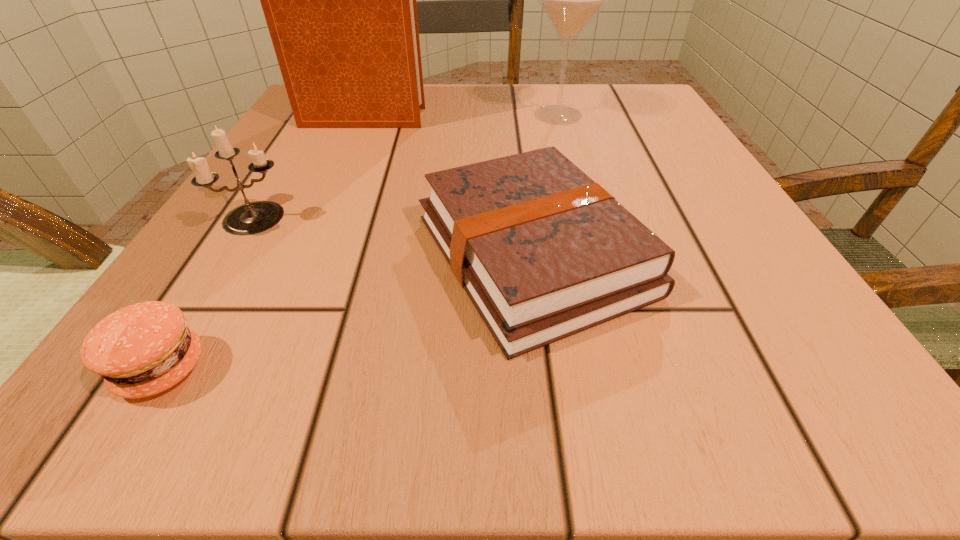
Identify the location of free region located 0.290m on the left of the shorter hardback book. (191, 254).

Where is `free point located 0.290m on the right of the patty`? The width and height of the screenshot is (960, 540). free point located 0.290m on the right of the patty is located at coordinates (491, 368).

Locate an element on the screen. This screenshot has width=960, height=540. hardback book that is at the far edge is located at coordinates (339, 0).

Where is `martini positioned at the far edge`? The width and height of the screenshot is (960, 540). martini positioned at the far edge is located at coordinates (570, 0).

This screenshot has height=540, width=960. I want to click on hardback book present at the near edge, so click(543, 252).

Locate an element on the screen. patty present at the near edge is located at coordinates (143, 349).

At what (x,y) coordinates should I click in order to perform the action: click on hardback book that is at the left edge. Please return your answer as a coordinate pair (x, y). Looking at the image, I should click on (339, 0).

Image resolution: width=960 pixels, height=540 pixels. What are the coordinates of `candle holder located in the left edge section of the desktop` in the screenshot? It's located at (250, 218).

Image resolution: width=960 pixels, height=540 pixels. Identify the location of patty present at the left edge. (143, 349).

The width and height of the screenshot is (960, 540). Find the location of `martini located in the right edge section of the desktop`. martini located in the right edge section of the desktop is located at coordinates (570, 0).